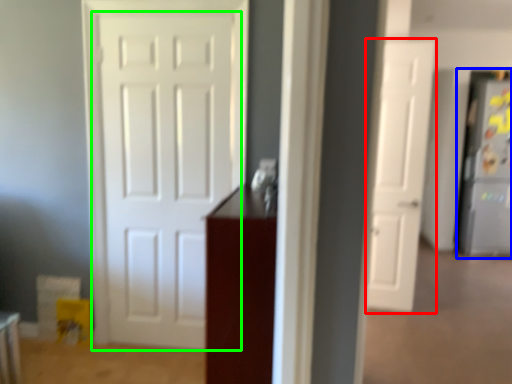
Question: Estimate the real-world distances between objects in this image. Which object is farther from door (highlighted by a red box), fridge (highlighted by a blue box) or door (highlighted by a green box)?

Choices:
 (A) fridge
 (B) door

Answer: (A)